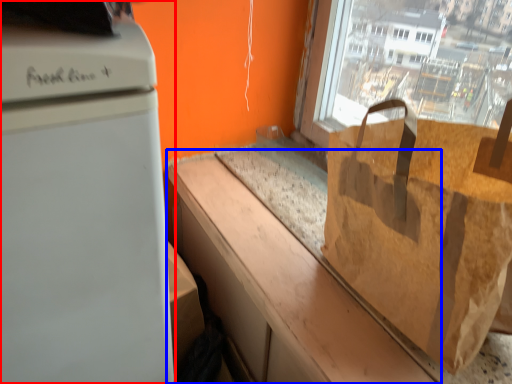
Question: Which object appears closest to the camera in this image, home appliance (highlighted by a red box) or counter top (highlighted by a blue box)?

Choices:
 (A) home appliance
 (B) counter top

Answer: (A)